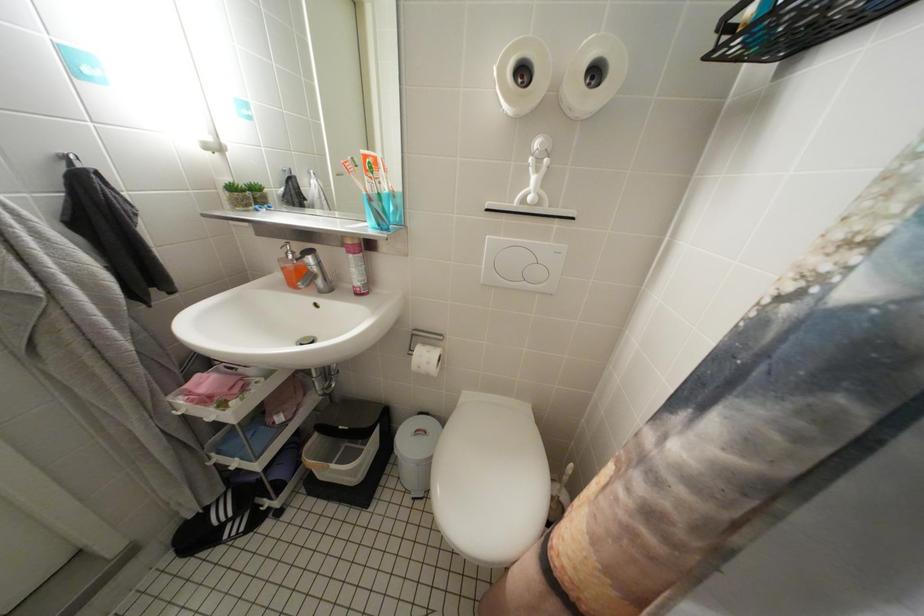
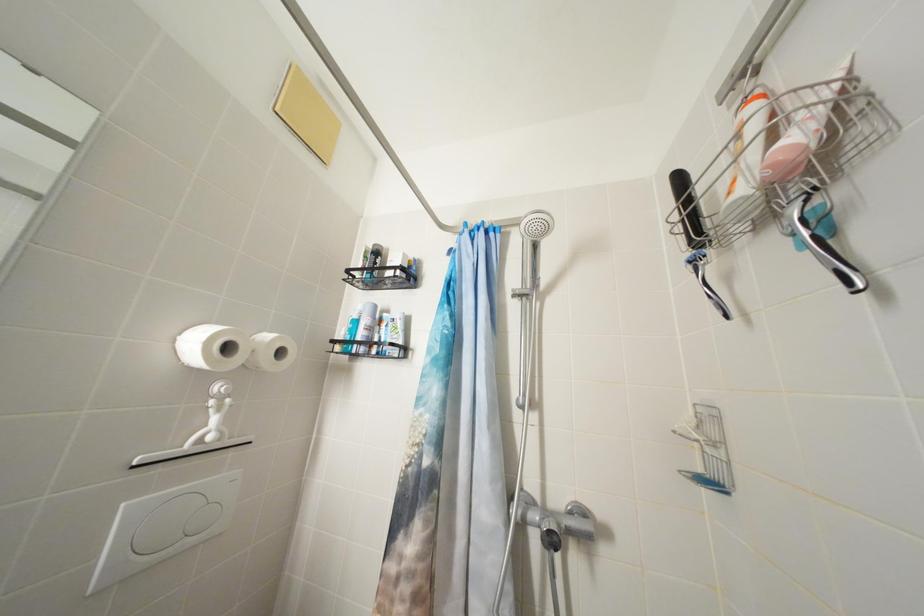
Question: The camera is either moving clockwise (left) or counter-clockwise (right) around the object. The first image is from the beginning of the video and the second image is from the end. Is the camera moving left or right when shooting the video?

Choices:
 (A) Left
 (B) Right

Answer: (A)